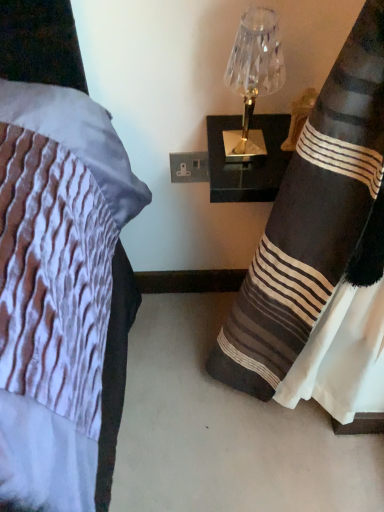
Question: From a real-world perspective, does black striped fabric at right sit lower than clear glass lamp at upper right?

Choices:
 (A) no
 (B) yes

Answer: (B)

Question: Is black striped fabric at right to the right of clear glass lamp at upper right from the viewer's perspective?

Choices:
 (A) yes
 (B) no

Answer: (A)

Question: Considering the relative sizes of black striped fabric at right and clear glass lamp at upper right in the image provided, is black striped fabric at right taller than clear glass lamp at upper right?

Choices:
 (A) no
 (B) yes

Answer: (B)

Question: Is clear glass lamp at upper right at the back of black striped fabric at right?

Choices:
 (A) yes
 (B) no

Answer: (B)

Question: Can you confirm if black striped fabric at right is wider than clear glass lamp at upper right?

Choices:
 (A) yes
 (B) no

Answer: (A)

Question: Would you say black striped fabric at right is a long distance from clear glass lamp at upper right?

Choices:
 (A) no
 (B) yes

Answer: (A)

Question: Is clear glass lamp at upper right outside black striped fabric at right?

Choices:
 (A) no
 (B) yes

Answer: (B)

Question: From a real-world perspective, is clear glass lamp at upper right physically below black striped fabric at right?

Choices:
 (A) yes
 (B) no

Answer: (B)

Question: Is clear glass lamp at upper right not near black striped fabric at right?

Choices:
 (A) no
 (B) yes

Answer: (A)

Question: Is clear glass lamp at upper right positioned with its back to black striped fabric at right?

Choices:
 (A) yes
 (B) no

Answer: (B)

Question: Is clear glass lamp at upper right closer to camera compared to black striped fabric at right?

Choices:
 (A) yes
 (B) no

Answer: (B)

Question: Would you say black striped fabric at right is part of clear glass lamp at upper right's contents?

Choices:
 (A) no
 (B) yes

Answer: (A)

Question: Is black striped fabric at right bigger or smaller than clear glass lamp at upper right?

Choices:
 (A) small
 (B) big

Answer: (B)